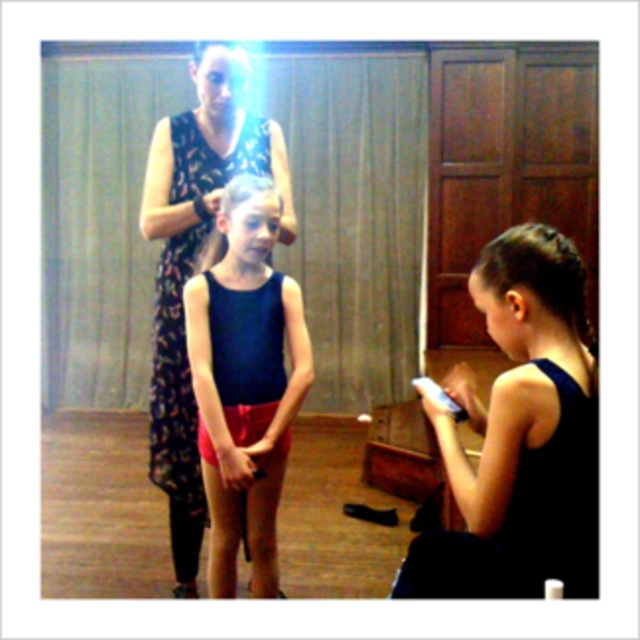
Question: Which of these objects is positioned farthest from the black shiny hair at right?

Choices:
 (A) blonde silky hair at upper center
 (B) floral-patterned fabric dress at center
 (C) blonde silky hair at center
 (D) shiny red shorts at center

Answer: (A)

Question: Does black shiny hair at right appear on the left side of blonde silky hair at upper center?

Choices:
 (A) yes
 (B) no

Answer: (B)

Question: Is floral-patterned fabric dress at center to the right of black shiny hair at right from the viewer's perspective?

Choices:
 (A) yes
 (B) no

Answer: (B)

Question: Which point is farther to the camera?

Choices:
 (A) (588, 522)
 (B) (230, 356)

Answer: (B)

Question: Among these points, which one is farthest from the camera?

Choices:
 (A) (488, 522)
 (B) (556, 300)

Answer: (B)

Question: Is shiny red shorts at center smaller than black shiny hair at right?

Choices:
 (A) no
 (B) yes

Answer: (A)